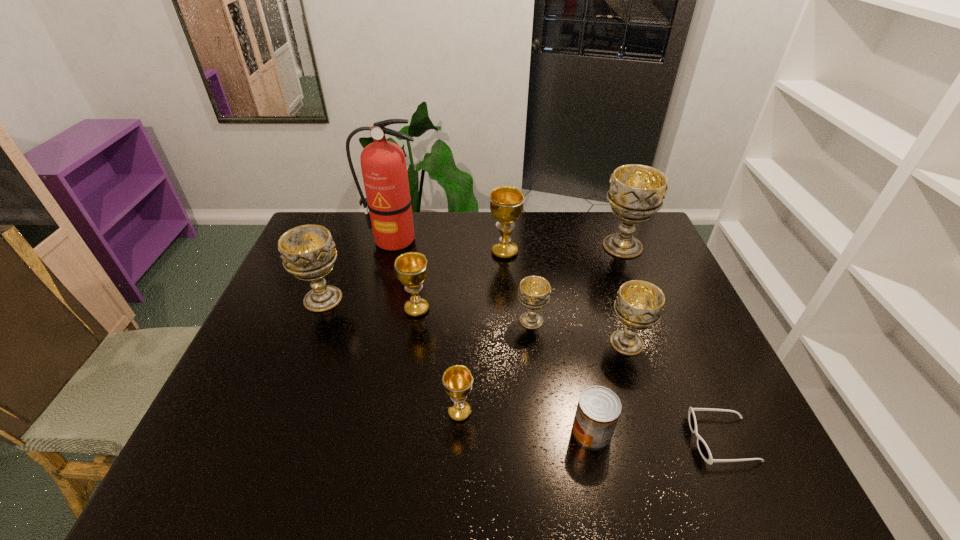
Identify the location of the tallest object. (383, 164).

Locate an element on the screen. The height and width of the screenshot is (540, 960). fire extinguisher is located at coordinates (383, 164).

Where is `the tallest chalice`? This screenshot has width=960, height=540. the tallest chalice is located at coordinates (636, 192).

The height and width of the screenshot is (540, 960). Find the location of `the biggest white chalice`. the biggest white chalice is located at coordinates tap(636, 192).

Locate an element on the screen. The height and width of the screenshot is (540, 960). the leftmost chalice is located at coordinates 308,251.

The image size is (960, 540). I want to click on the second biggest white chalice, so click(x=308, y=251).

You are a GUI agent. You are given a task and a screenshot of the screen. Output one action in this format:
    pyautogui.click(x=<x>, y=<y>)
    Task: Click on the rightmost gold chalice
    The width and height of the screenshot is (960, 540).
    Given the screenshot: What is the action you would take?
    pyautogui.click(x=506, y=202)

At what (x,y) coordinates should I click in order to perform the action: click on the farthest gold chalice. Please return your answer as a coordinate pair (x, y). The image size is (960, 540). Looking at the image, I should click on (506, 202).

Find the location of a particular element. the second smallest white chalice is located at coordinates (639, 304).

Find the location of `the second chalice from left to right`. the second chalice from left to right is located at coordinates (411, 267).